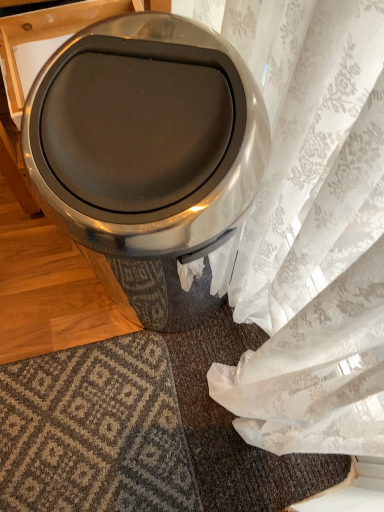
I want to click on vacant area that is in front of brushed metal trash can at center, so click(x=126, y=407).